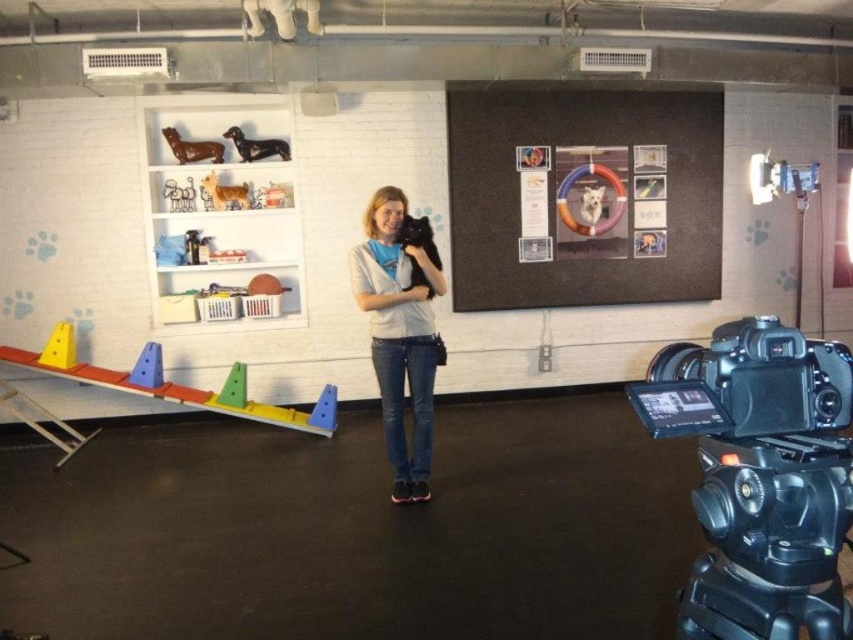
You are a photographer setting up equipment in the dog training area. You have a denim jeans at center and a black plastic tripod at lower right. Which object is closer to the left side of the room?

The denim jeans at center is to the left of the black plastic tripod at lower right, so the denim jeans at center is closer to the left side of the room.

You are setting up a video call and need to position your black plastic video camera at lower right so that it faces the center of the room. Given its current position at point 0.745, 0.892, will it be able to capture the entire room without any obstructions?

The black plastic video camera at lower right is positioned at point (759, 476). Since the room has a casual, functional design with exposed ductwork and a white brick wall, and the camera is placed at the lower right corner, it should have a clear view towards the center of the room. However, the large blackboard or corkboard to the right of the shelf might partially block the upper part of the room. To ensure full coverage, adjusting the camera angle slightly upward could help avoid obstructions fromthe

You are a photographer setting up equipment in the room. You need to adjust the position of the black plastic video camera at lower right so that it is farther from you than the denim jeans at center. Is the camera currently positioned correctly?

The black plastic video camera at lower right is currently closer to the viewer than the denim jeans at center, so it is not positioned correctly as it needs to be farther away.